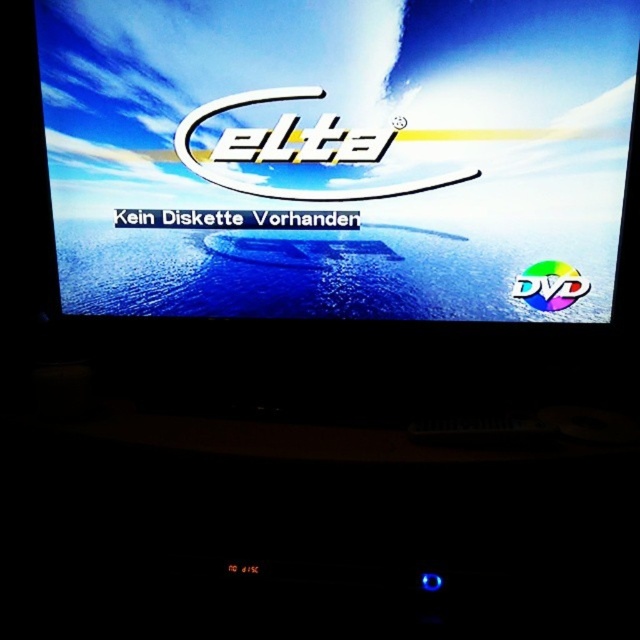
Does matte plastic screen at center appear on the left side of rainbow plastic dvd at right?

Indeed, matte plastic screen at center is positioned on the left side of rainbow plastic dvd at right.

Between point (374, 90) and point (563, 260), which one is positioned behind?

The point (563, 260) is more distant.

Between point (476, 301) and point (541, 275), which one is positioned behind?

The point (476, 301) is more distant.

At what (x,y) coordinates should I click in order to perform the action: click on matte plastic screen at center. Please return your answer as a coordinate pair (x, y). Looking at the image, I should click on (333, 154).